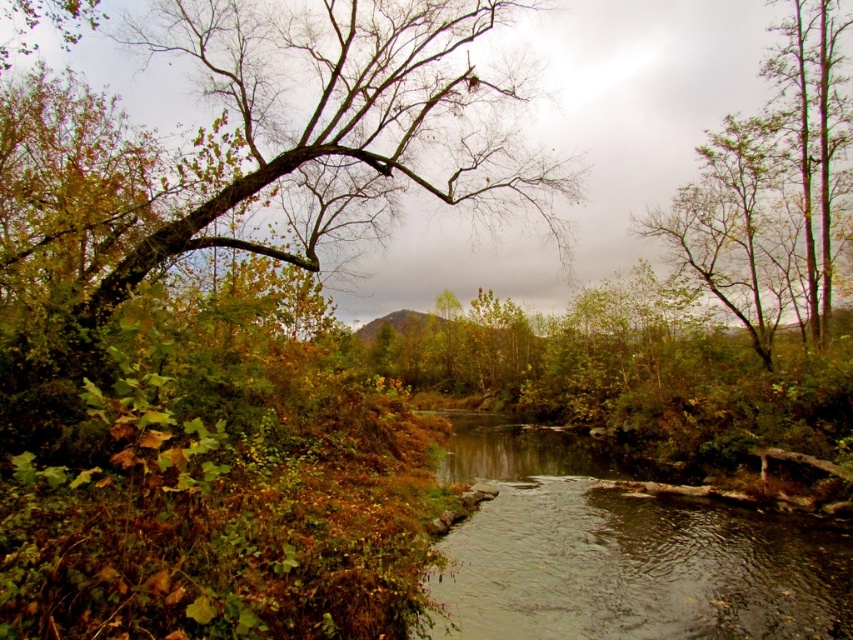
You are planning to build a small wooden bridge over the brown liquid water at lower center. The bridge needs to be as wide as the green leafy tree at left to accommodate pedestrians. Is the bridge wide enough to span the water?

→ The green leafy tree at left might be wider than brown liquid water at lower center, so the bridge, which is as wide as the tree, might be wide enough to span the water.

You are a hiker trying to cross the river using a fallen log. You see the green leafy tree at left and the brown liquid water at lower center. Which object should you avoid stepping into to stay safe?

You should avoid stepping into the brown liquid water at lower center because it is liquid and could be unsafe, while the green leafy tree at left is solid ground.

You are standing at the edge of the river and want to walk towards the green leafy tree at left. Will you first step onto the brown liquid water at lower center before reaching the tree?

The green leafy tree at left is further to the viewer than the brown liquid water at lower center, so you will first step onto the brown liquid water at lower center before reaching the tree.